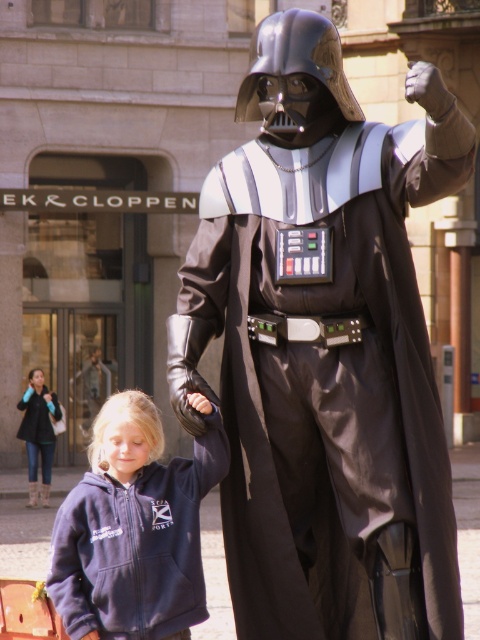
Who is lower down, navy fleece hoodie at lower left or denim jacket at lower left?

denim jacket at lower left

Does point (119, 392) come farther from viewer compared to point (38, 424)?

Yes, it is.

Where is `navy fleece hoodie at lower left`? navy fleece hoodie at lower left is located at coordinates (134, 529).

Which is below, shiny black costume at center or denim jacket at lower left?

denim jacket at lower left is lower down.

What are the coordinates of `shiny black costume at center` in the screenshot? It's located at (324, 349).

Locate an element on the screen. The width and height of the screenshot is (480, 640). shiny black costume at center is located at coordinates (324, 349).

Is point (220, 280) less distant than point (165, 552)?

That is True.

Who is more forward, [364,253] or [96,492]?

Point [364,253] is more forward.

Measure the distance between shiny black costume at center and camera.

shiny black costume at center and camera are 51.83 feet apart from each other.

Find the location of `shiny black costume at center`. shiny black costume at center is located at coordinates (324, 349).